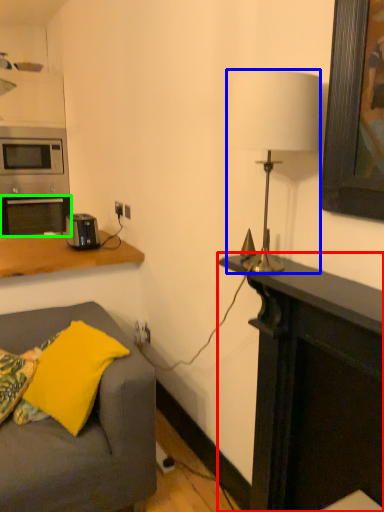
Question: Which object is positioned closest to desk (highlighted by a red box)? Select from lamp (highlighted by a blue box) and oven (highlighted by a green box).

Choices:
 (A) lamp
 (B) oven

Answer: (A)